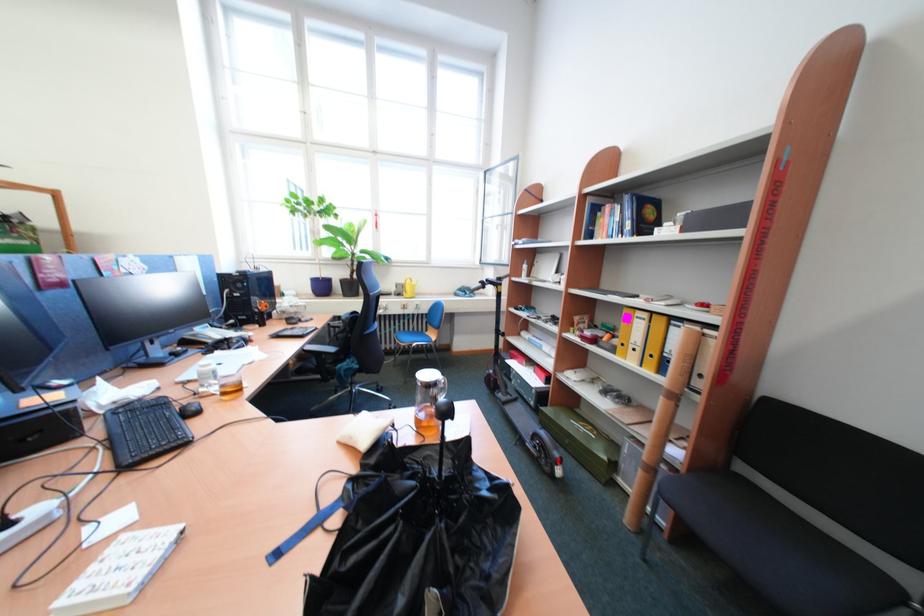
Where would you lift the white covered book? Please return your answer as a coordinate pair (x, y).

(118, 570)